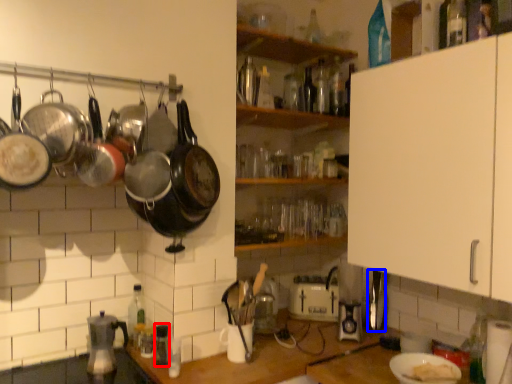
Question: Among these objects, which one is farthest to the camera, appliance (highlighted by a red box) or appliance (highlighted by a blue box)?

Choices:
 (A) appliance
 (B) appliance

Answer: (B)